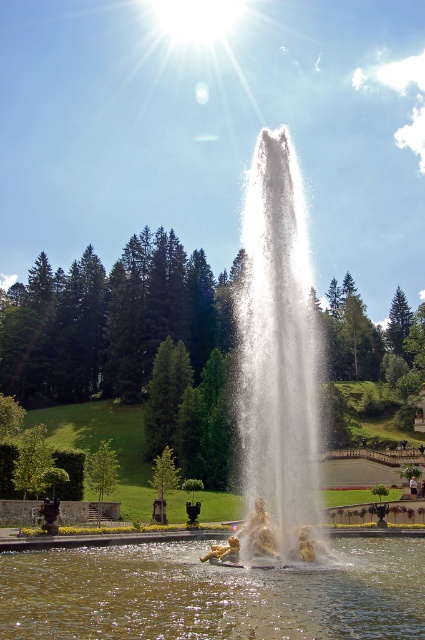
Is clear water at fountain center below white water at center?

Indeed, clear water at fountain center is positioned under white water at center.

Is clear water at fountain center wider than white water at center?

No, clear water at fountain center is not wider than white water at center.

From the picture: Who is more distant from viewer, (362, 636) or (291, 392)?

Positioned behind is point (291, 392).

This screenshot has height=640, width=425. What are the coordinates of `clear water at fountain center` in the screenshot? It's located at (212, 593).